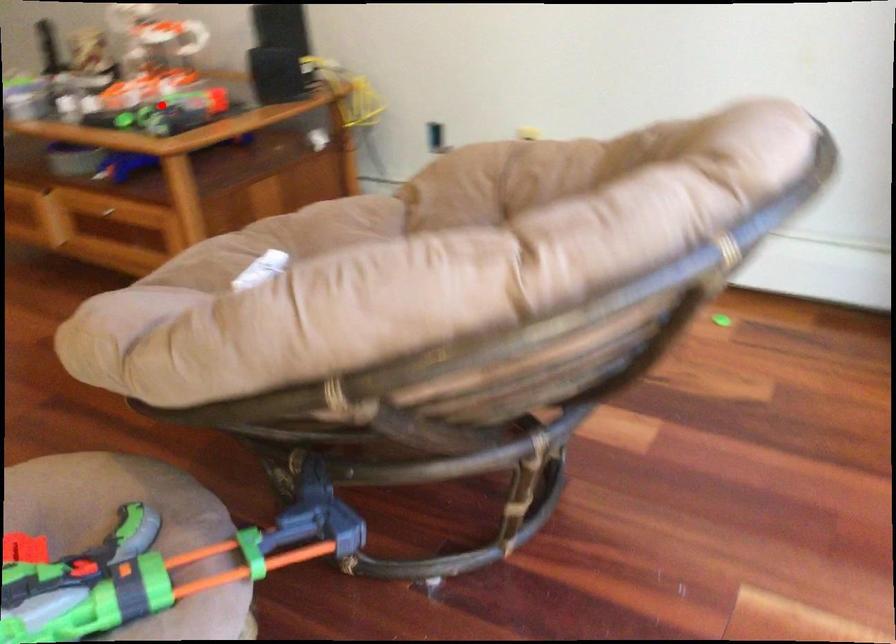
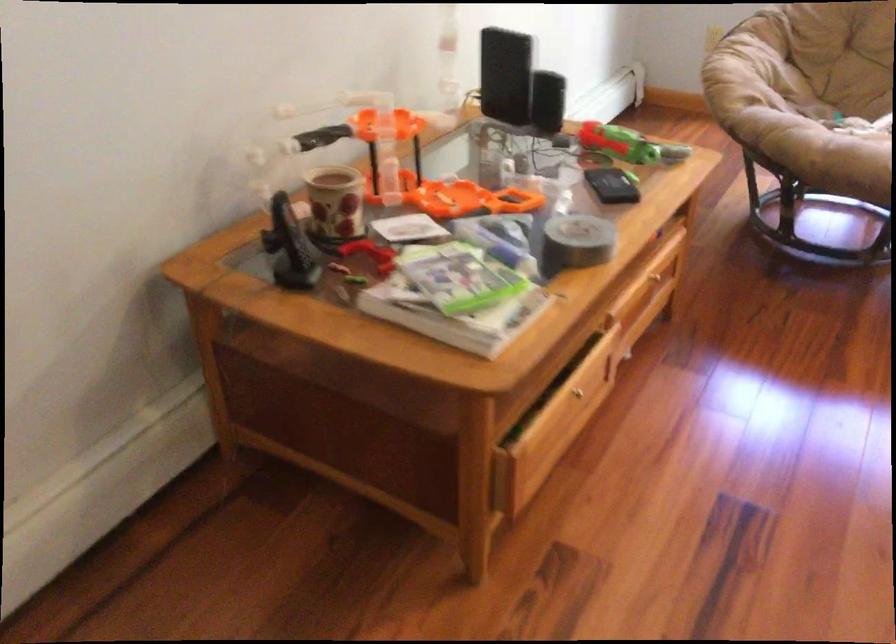
Find the pixel in the second image that matches the highlighted location in the first image.

(627, 145)